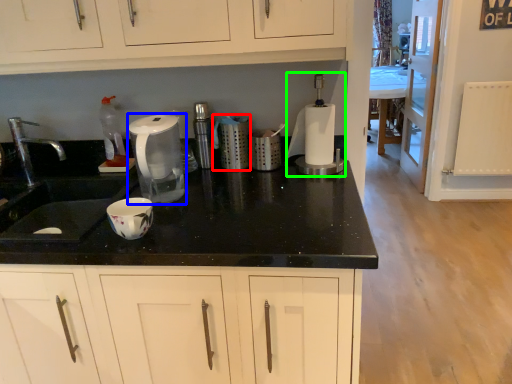
Question: Which is nearer to the kitchen appliance (highlighted by a red box)? home appliance (highlighted by a blue box) or blender (highlighted by a green box).

Choices:
 (A) home appliance
 (B) blender

Answer: (B)